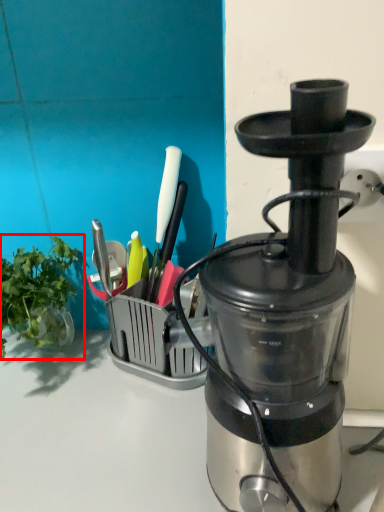
Question: From the image's perspective, what is the correct spatial relationship of vegetable (annotated by the red box) in relation to blender?

Choices:
 (A) below
 (B) above

Answer: (A)